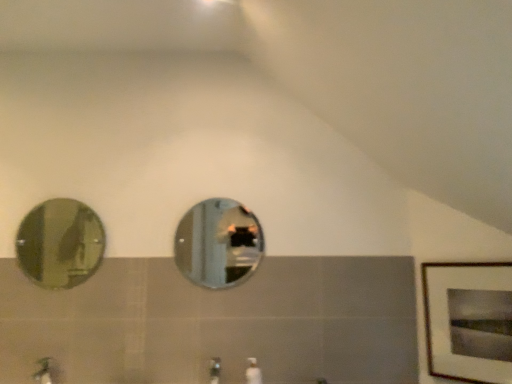
Question: Is white glossy soap dispenser at center smaller than silver reflective mirror at center, the 1th mirror when ordered from right to left?

Choices:
 (A) yes
 (B) no

Answer: (A)

Question: Considering the relative positions of white glossy soap dispenser at center and silver reflective mirror at center, the 1th mirror when ordered from right to left, in the image provided, is white glossy soap dispenser at center to the left of silver reflective mirror at center, the 1th mirror when ordered from right to left, from the viewer's perspective?

Choices:
 (A) no
 (B) yes

Answer: (A)

Question: Is white glossy soap dispenser at center aimed at silver reflective mirror at center, the second mirror from the left?

Choices:
 (A) no
 (B) yes

Answer: (A)

Question: Is white glossy soap dispenser at center completely or partially outside of silver reflective mirror at center, the second mirror from the left?

Choices:
 (A) yes
 (B) no

Answer: (A)

Question: Is white glossy soap dispenser at center further to the viewer compared to silver reflective mirror at center, the second mirror from the left?

Choices:
 (A) no
 (B) yes

Answer: (A)

Question: Considering the positions of point (260, 369) and point (64, 276), is point (260, 369) closer or farther from the camera than point (64, 276)?

Choices:
 (A) farther
 (B) closer

Answer: (B)

Question: Is white glossy soap dispenser at center bigger or smaller than green glass mirror at left, acting as the 1th mirror starting from the left?

Choices:
 (A) small
 (B) big

Answer: (A)

Question: Visually, is white glossy soap dispenser at center positioned to the left or to the right of green glass mirror at left, acting as the 1th mirror starting from the left?

Choices:
 (A) left
 (B) right

Answer: (B)

Question: Relative to green glass mirror at left, which is counted as the 2th mirror, starting from the right, is white glossy soap dispenser at center in front or behind?

Choices:
 (A) front
 (B) behind

Answer: (A)

Question: Considering the positions of brushed metal faucet at lower center, the 2th faucet positioned from the left, and wooden framed print at right in the image, is brushed metal faucet at lower center, the 2th faucet positioned from the left, taller or shorter than wooden framed print at right?

Choices:
 (A) tall
 (B) short

Answer: (B)

Question: From a real-world perspective, is brushed metal faucet at lower center, the 2th faucet positioned from the left, physically located above or below wooden framed print at right?

Choices:
 (A) above
 (B) below

Answer: (B)

Question: From the image's perspective, is brushed metal faucet at lower center, the 2th faucet positioned from the left, located above or below wooden framed print at right?

Choices:
 (A) below
 (B) above

Answer: (A)

Question: In terms of width, does brushed metal faucet at lower center, the first faucet viewed from the right, look wider or thinner when compared to wooden framed print at right?

Choices:
 (A) wide
 (B) thin

Answer: (A)

Question: Is silver reflective mirror at center, the second mirror from the left, to the left or to the right of wooden framed print at right in the image?

Choices:
 (A) left
 (B) right

Answer: (A)

Question: From the image's perspective, is silver reflective mirror at center, the second mirror from the left, positioned above or below wooden framed print at right?

Choices:
 (A) below
 (B) above

Answer: (B)